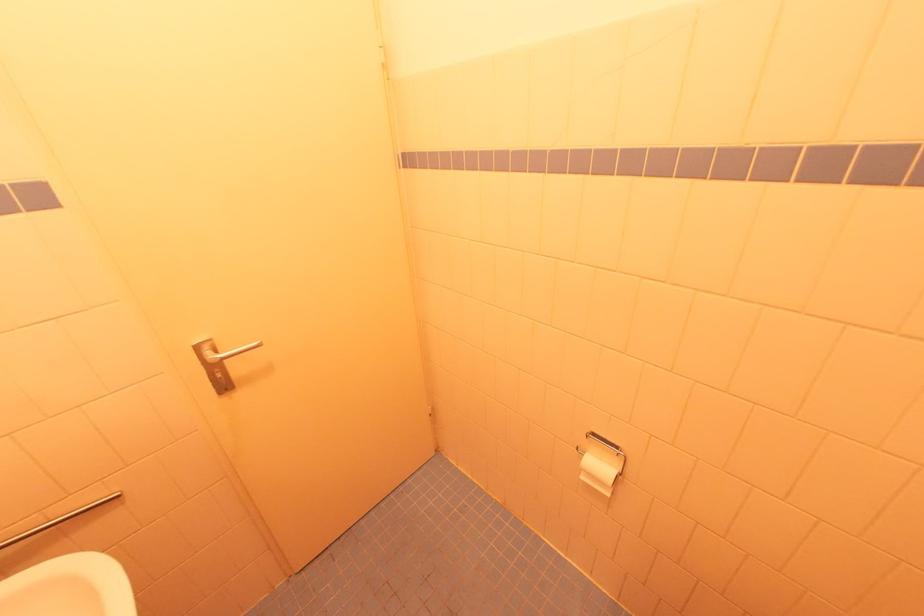
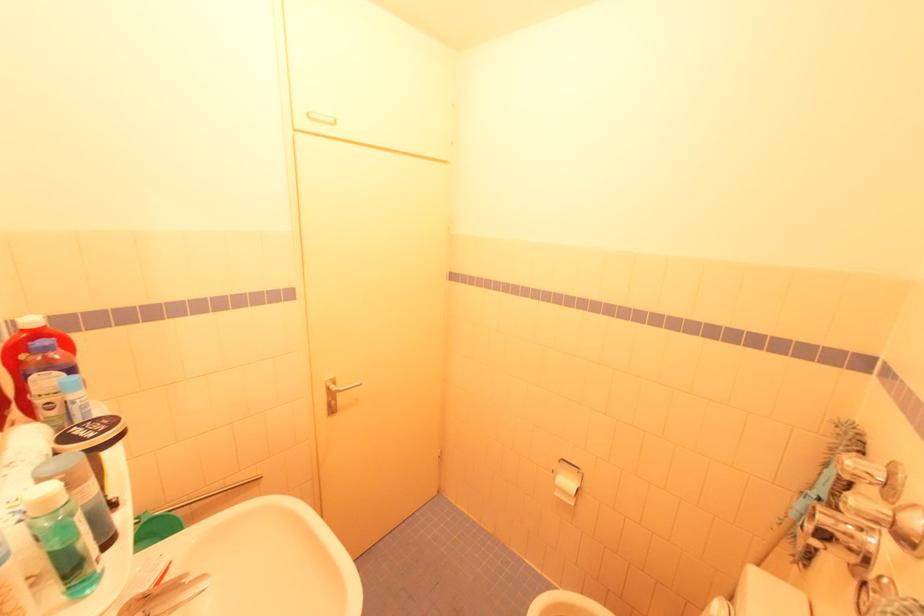
Question: The first image is from the beginning of the video and the second image is from the end. How did the camera likely rotate when shooting the video?

Choices:
 (A) Left
 (B) Right
 (C) Up
 (D) Down

Answer: (C)